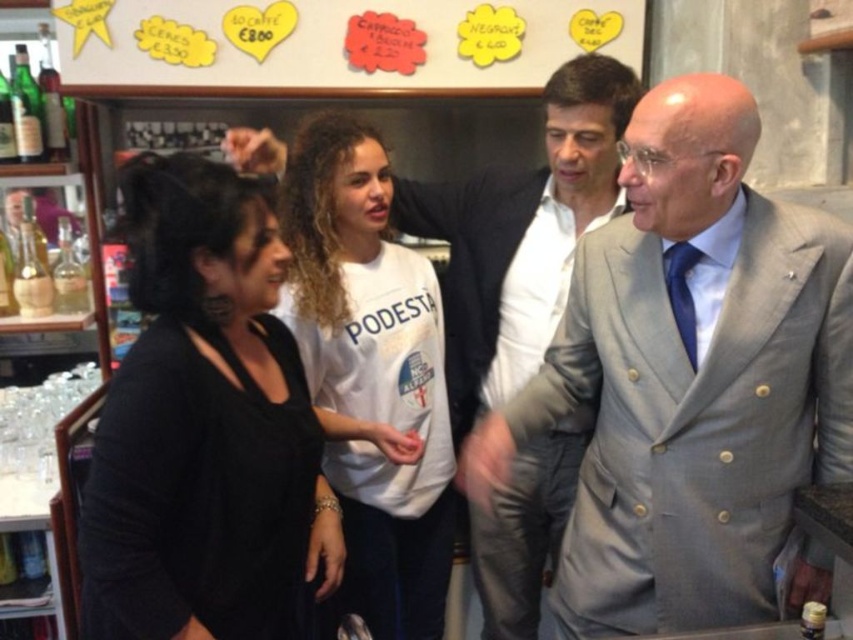
You are a barista working behind the counter in the scene. A customer wearing the gray wool suit at center and another wearing the black matte shirt at left are standing in line. The counter is 20 inches wide. Can both customers fit side by side at the counter?

The gray wool suit at center is 19.51 inches away from the black matte shirt at left, so yes, both customers can fit side by side at the counter since the distance between them is less than the counter width of 20 inches.